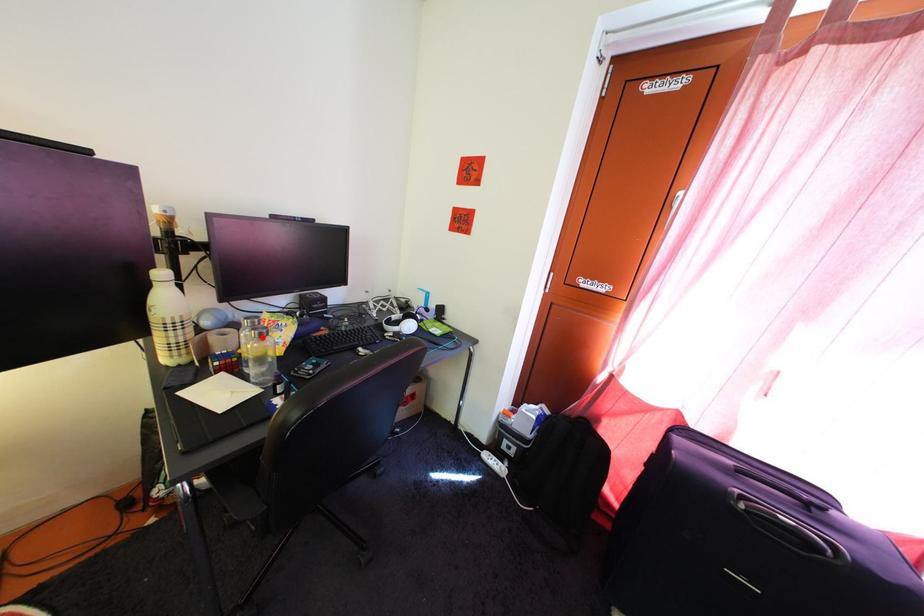
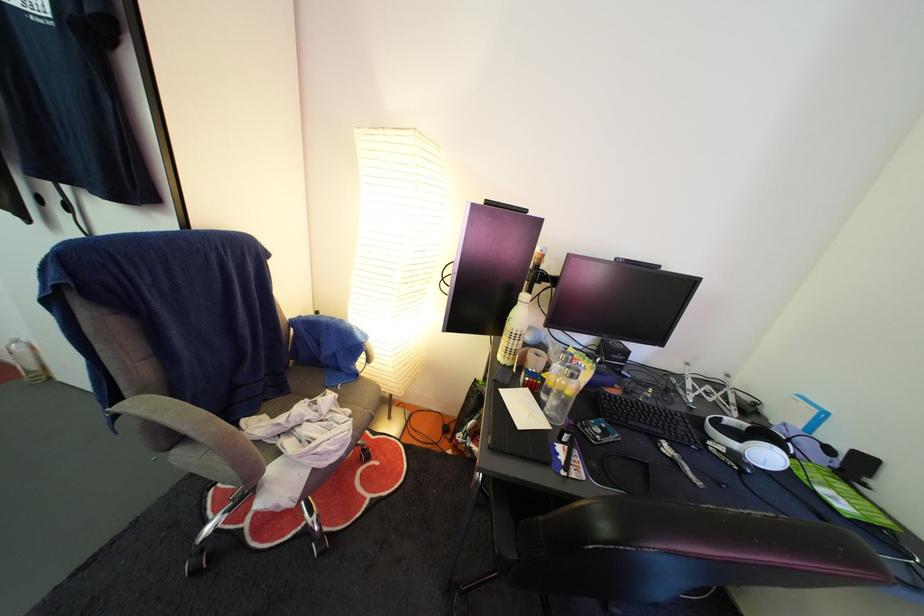
Locate, in the second image, the point that corresponds to the highlighted location in the first image.

(578, 376)